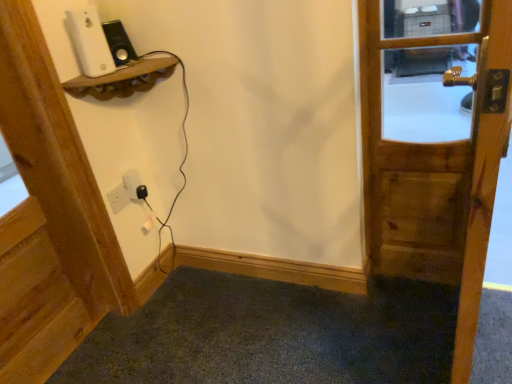
Question: Considering the relative sizes of wooden door at upper left, arranged as the 2th door when viewed from the right, and black plastic plug at lower center in the image provided, is wooden door at upper left, arranged as the 2th door when viewed from the right, bigger than black plastic plug at lower center?

Choices:
 (A) yes
 (B) no

Answer: (A)

Question: Can you confirm if wooden door at upper left, arranged as the 2th door when viewed from the right, is positioned to the right of black plastic plug at lower center?

Choices:
 (A) no
 (B) yes

Answer: (A)

Question: Is wooden door at upper left, which ranks as the first door in left-to-right order, in front of black plastic plug at lower center?

Choices:
 (A) no
 (B) yes

Answer: (B)

Question: Does wooden door at upper left, arranged as the 2th door when viewed from the right, have a lesser height compared to black plastic plug at lower center?

Choices:
 (A) no
 (B) yes

Answer: (A)

Question: Can you confirm if wooden door at upper left, which ranks as the first door in left-to-right order, is wider than black plastic plug at lower center?

Choices:
 (A) no
 (B) yes

Answer: (B)

Question: From a real-world perspective, relative to white matte ipod at upper left, is wooden door at upper left, which ranks as the first door in left-to-right order, vertically above or below?

Choices:
 (A) below
 (B) above

Answer: (A)

Question: Is wooden door at upper left, arranged as the 2th door when viewed from the right, to the left or to the right of white matte ipod at upper left in the image?

Choices:
 (A) right
 (B) left

Answer: (B)

Question: Which is correct: wooden door at upper left, arranged as the 2th door when viewed from the right, is inside white matte ipod at upper left, or outside of it?

Choices:
 (A) outside
 (B) inside

Answer: (A)

Question: Is point (50, 243) closer or farther from the camera than point (97, 36)?

Choices:
 (A) farther
 (B) closer

Answer: (A)

Question: Considering the positions of white matte ipod at upper left and black plastic plug at lower center in the image, is white matte ipod at upper left taller or shorter than black plastic plug at lower center?

Choices:
 (A) short
 (B) tall

Answer: (B)

Question: Is white matte ipod at upper left situated inside black plastic plug at lower center or outside?

Choices:
 (A) outside
 (B) inside

Answer: (A)

Question: Considering the positions of white matte ipod at upper left and black plastic plug at lower center in the image, is white matte ipod at upper left bigger or smaller than black plastic plug at lower center?

Choices:
 (A) small
 (B) big

Answer: (B)

Question: In the image, is white matte ipod at upper left positioned in front of or behind black plastic plug at lower center?

Choices:
 (A) front
 (B) behind

Answer: (A)

Question: Does point (137, 193) appear closer or farther from the camera than point (34, 263)?

Choices:
 (A) closer
 (B) farther

Answer: (B)

Question: Visually, is black plastic plug at lower center positioned to the left or to the right of wooden door at upper left, which ranks as the first door in left-to-right order?

Choices:
 (A) left
 (B) right

Answer: (B)